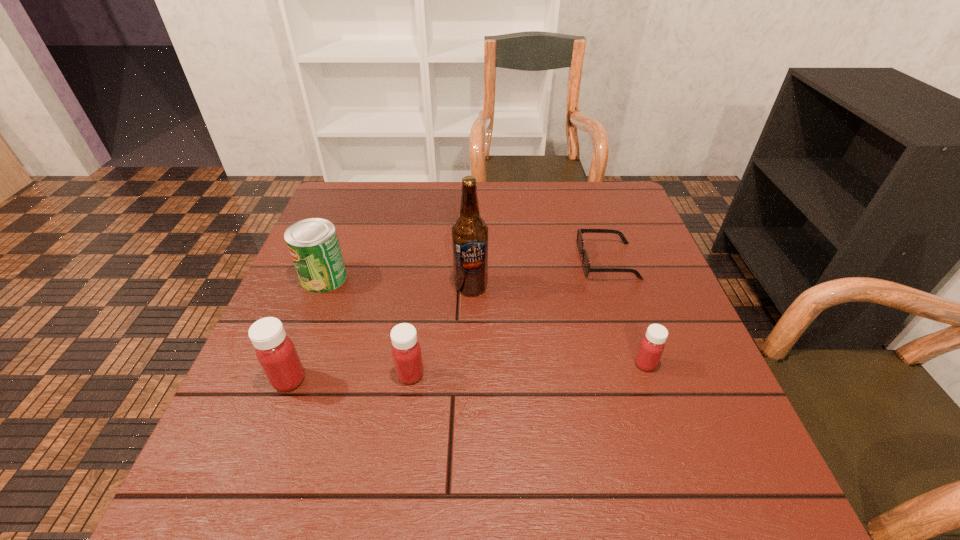
At what (x,y) coordinates should I click in order to perform the action: click on unoccupied position between the fifth tallest object and the tallest object. Please return your answer as a coordinate pair (x, y). Looking at the image, I should click on tap(558, 325).

Where is `free space between the leftmost medicine and the shortest object`? free space between the leftmost medicine and the shortest object is located at coordinates (448, 320).

This screenshot has width=960, height=540. Identify the location of free space between the shortest object and the second medicine from right to left. (509, 318).

You are a GUI agent. You are given a task and a screenshot of the screen. Output one action in this format:
    pyautogui.click(x=<x>, y=<y>)
    Task: Click on the empty space that is in between the tallest object and the tallest medicine
    
    Given the screenshot: What is the action you would take?
    pyautogui.click(x=380, y=333)

The width and height of the screenshot is (960, 540). Find the location of `free space between the third object from left to right and the shortest medicine`. free space between the third object from left to right and the shortest medicine is located at coordinates (528, 369).

The width and height of the screenshot is (960, 540). Find the location of `vacant region between the shortest object and the tallest object`. vacant region between the shortest object and the tallest object is located at coordinates (540, 274).

Choose which object is the third nearest neighbor to the leftmost medicine. Please provide its 2D coordinates. Your answer should be formatted as a tuple, i.e. [(x, y)], where the tuple contains the x and y coordinates of a point satisfying the conditions above.

[(469, 233)]

Identify which object is located as the second nearest to the shortest object. Please provide its 2D coordinates. Your answer should be formatted as a tuple, i.e. [(x, y)], where the tuple contains the x and y coordinates of a point satisfying the conditions above.

[(469, 233)]

I want to click on the second closest medicine relative to the fourth object from right to left, so click(x=652, y=345).

Image resolution: width=960 pixels, height=540 pixels. Find the location of `medicine that is the third closest to the can`. medicine that is the third closest to the can is located at coordinates (652, 345).